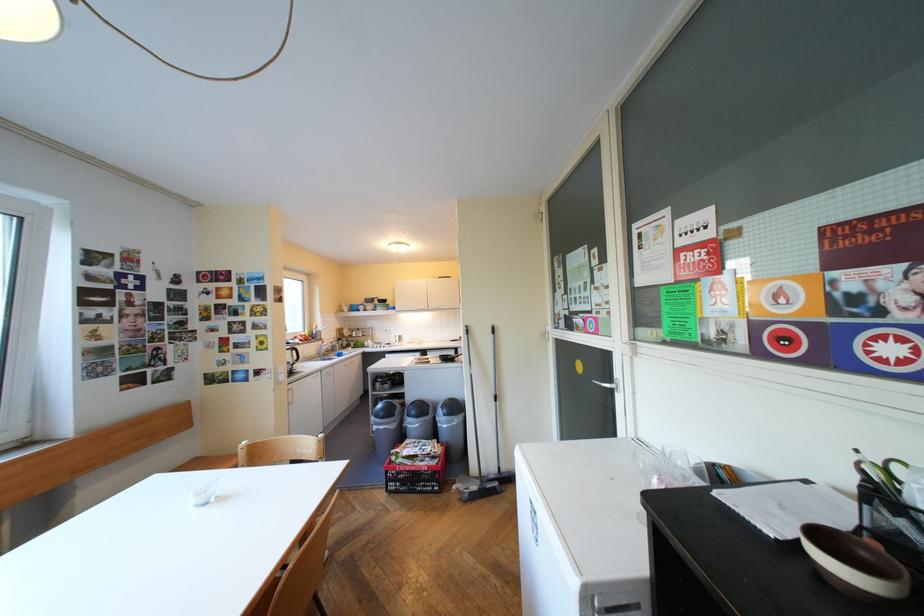
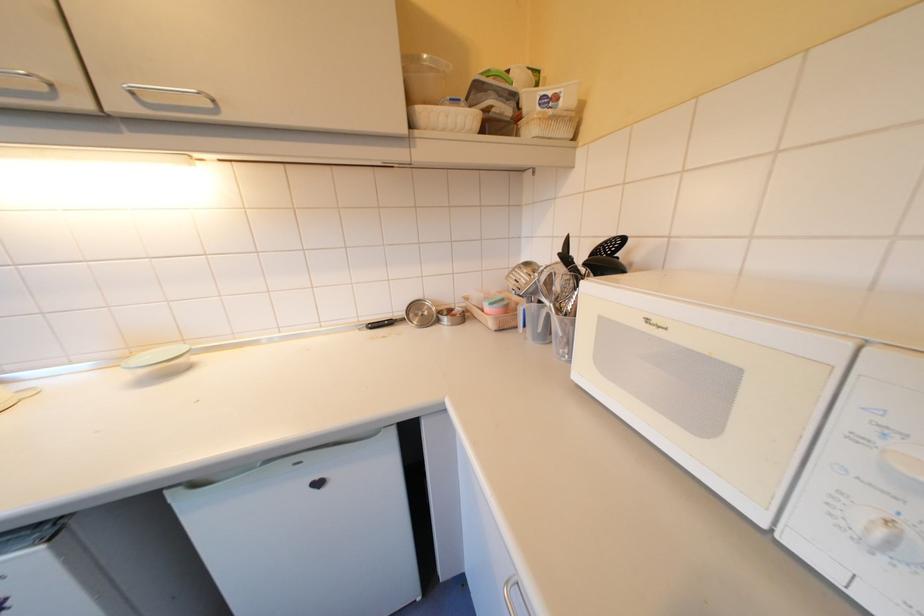
Question: In a continuous first-person perspective shot, in which direction is the camera moving?

Choices:
 (A) Left
 (B) Right
 (C) Forward
 (D) Backward

Answer: (C)